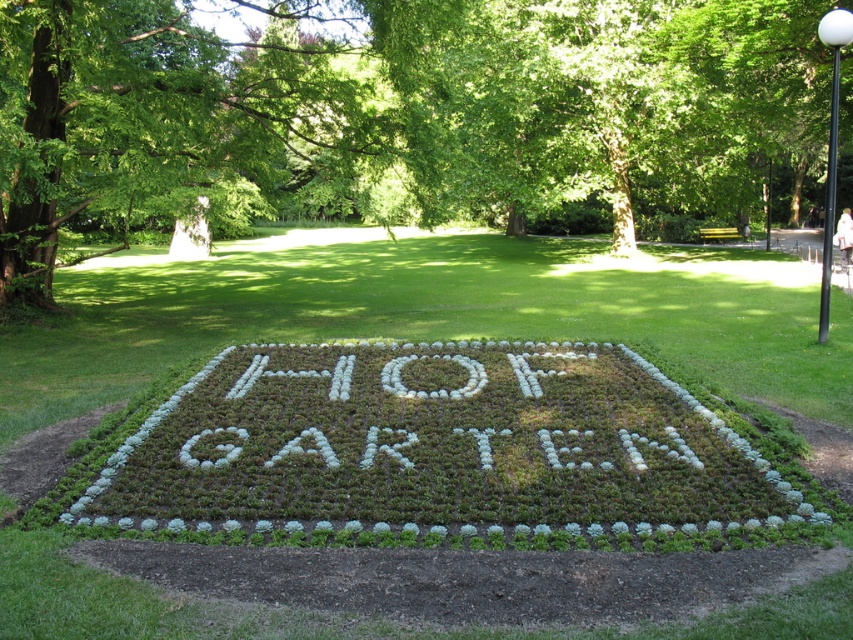
Question: Which point is closer to the camera?

Choices:
 (A) (751, 54)
 (B) (825, 278)
 (C) (4, 289)

Answer: (B)

Question: Does green leafy tree at center appear over green grass at center?

Choices:
 (A) no
 (B) yes

Answer: (B)

Question: Considering the relative positions of green grass at center and green leafy tree at upper left in the image provided, where is green grass at center located with respect to green leafy tree at upper left?

Choices:
 (A) right
 (B) left

Answer: (A)

Question: Is green leafy tree at center above green leafy tree at upper left?

Choices:
 (A) yes
 (B) no

Answer: (A)

Question: Which object is the closest to the black metal pole at upper right?

Choices:
 (A) green grass at center
 (B) green leafy tree at center

Answer: (A)

Question: Which object is positioned closest to the green grass at center?

Choices:
 (A) black metal pole at upper right
 (B) green leafy tree at upper left

Answer: (B)